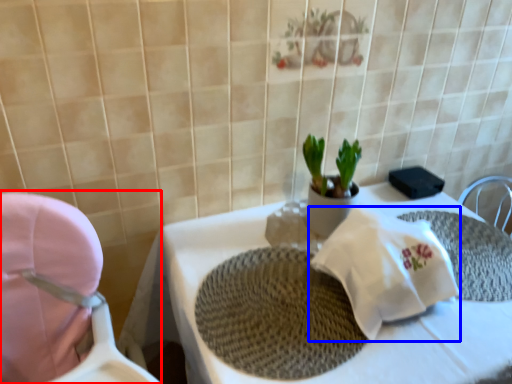
Question: Which object is further to the camera taking this photo, baby carriage (highlighted by a red box) or material (highlighted by a blue box)?

Choices:
 (A) baby carriage
 (B) material

Answer: (B)